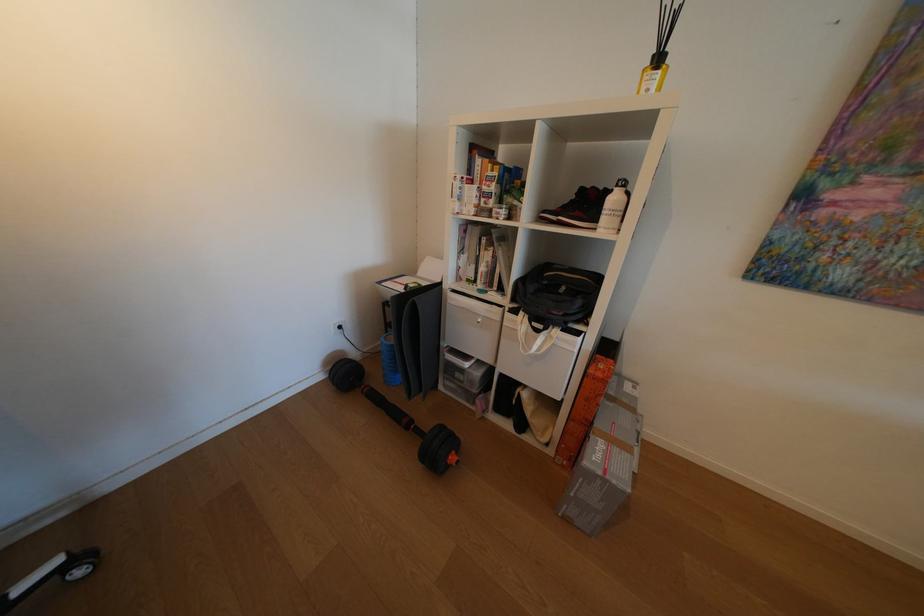
The width and height of the screenshot is (924, 616). What do you see at coordinates (388, 361) in the screenshot?
I see `the blue foam roller` at bounding box center [388, 361].